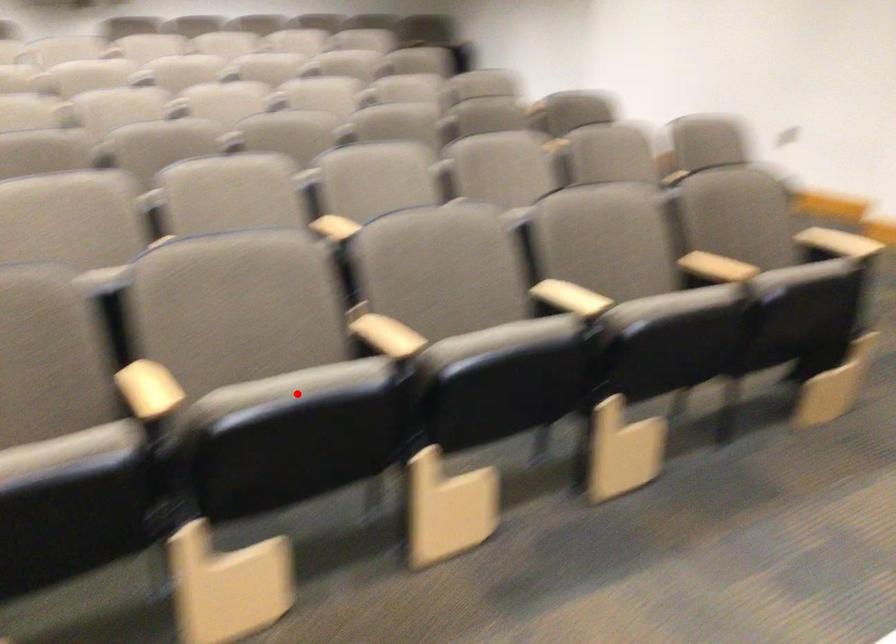
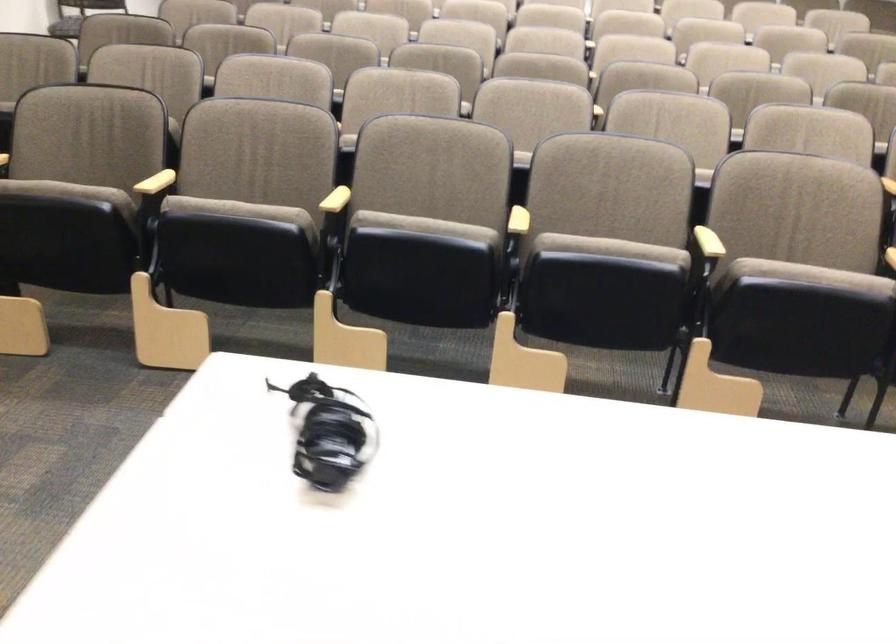
Locate, in the second image, the point that corresponds to the highlighted location in the first image.

(424, 225)